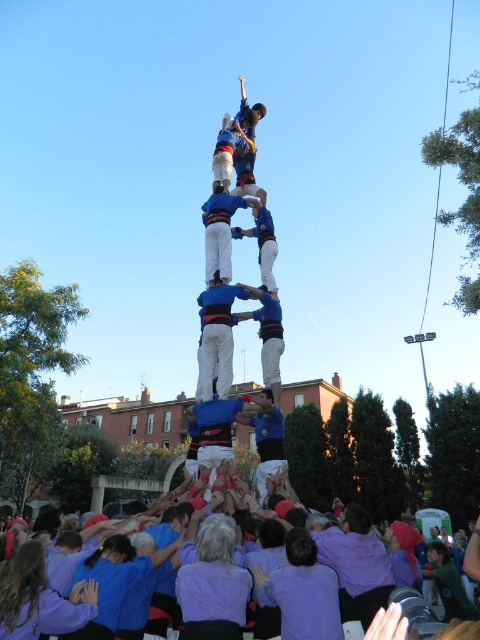
Is purple cotton shirts at lower center positioned at the back of blue fabric person at center?

That is False.

Does purple cotton shirts at lower center appear on the left side of blue fabric person at center?

Indeed, purple cotton shirts at lower center is positioned on the left side of blue fabric person at center.

Which is behind, point (17, 637) or point (207, 420)?

Positioned behind is point (207, 420).

I want to click on purple cotton shirts at lower center, so click(x=60, y=611).

Is white cotton shirt at center thinner than blue fabric person at center?

Yes.

Which is below, white cotton shirt at center or blue fabric person at center?

blue fabric person at center

I want to click on white cotton shirt at center, so click(216, 337).

Identify the location of white cotton shirt at center. pos(216,337).

Is point (57, 614) farther from camera compared to point (216, 300)?

That is False.

Is point (61, 612) behind point (228, 317)?

No.

You are a GUI agent. You are given a task and a screenshot of the screen. Output one action in this format:
    pyautogui.click(x=<x>, y=<y>)
    Task: Click on the purple cotton shirts at lower center
    
    Given the screenshot: What is the action you would take?
    pyautogui.click(x=60, y=611)